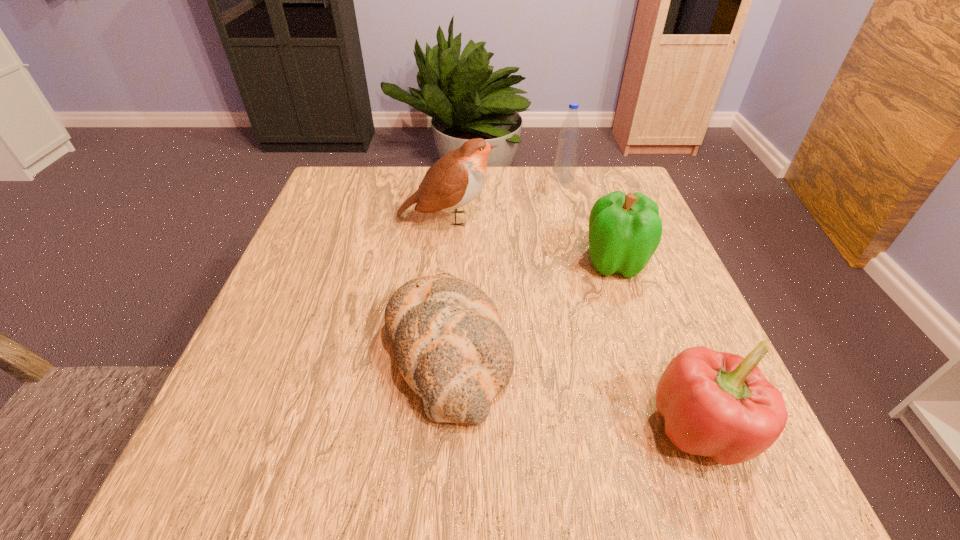
You are a GUI agent. You are given a task and a screenshot of the screen. Output one action in this format:
    pyautogui.click(x=<x>, y=<y>)
    Task: Click on the farthest object
    The width and height of the screenshot is (960, 540).
    Given the screenshot: What is the action you would take?
    pyautogui.click(x=566, y=157)

Image resolution: width=960 pixels, height=540 pixels. In order to click on bird in this screenshot , I will do `click(454, 180)`.

Locate an element on the screen. The height and width of the screenshot is (540, 960). the third nearest object is located at coordinates (625, 230).

Identify the location of the nearer bell pepper. The image size is (960, 540). (716, 404).

You are a GUI agent. You are given a task and a screenshot of the screen. Output one action in this format:
    pyautogui.click(x=<x>, y=<y>)
    Task: Click on the bread
    The height and width of the screenshot is (540, 960).
    Given the screenshot: What is the action you would take?
    pyautogui.click(x=450, y=347)

Where is `vacant space located on the left of the farthest object`? This screenshot has width=960, height=540. vacant space located on the left of the farthest object is located at coordinates (454, 178).

At what (x,y) coordinates should I click in order to perform the action: click on vacant point located 0.250m at the face of the bird. Please return your answer as a coordinate pair (x, y). This screenshot has height=540, width=960. Looking at the image, I should click on (600, 219).

This screenshot has height=540, width=960. Find the location of `vacant space located on the back of the farther bell pepper`. vacant space located on the back of the farther bell pepper is located at coordinates (585, 173).

Identify the location of vacant space located on the back of the nearer bell pepper. Image resolution: width=960 pixels, height=540 pixels. (630, 247).

Where is `blank space located on the left of the shortest object`? blank space located on the left of the shortest object is located at coordinates (282, 350).